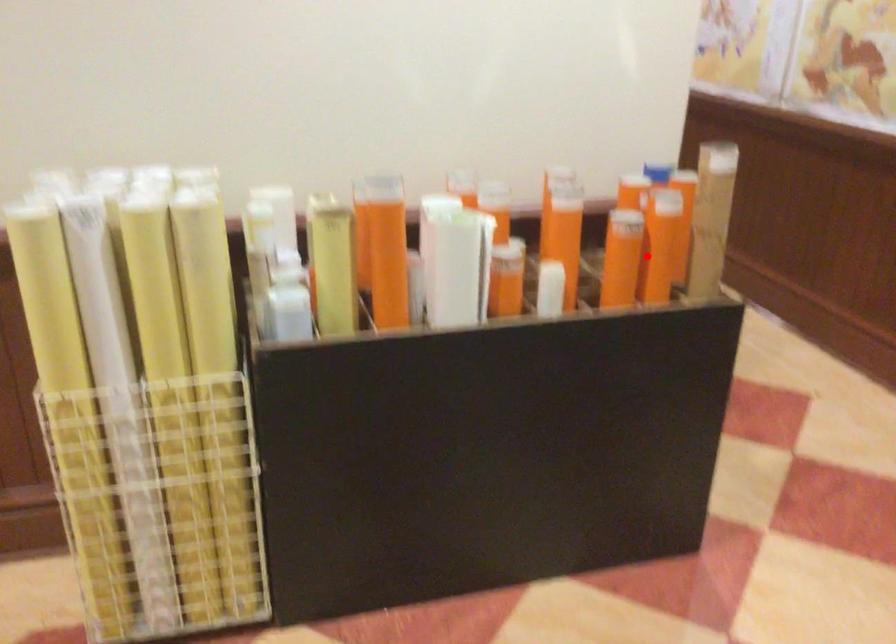
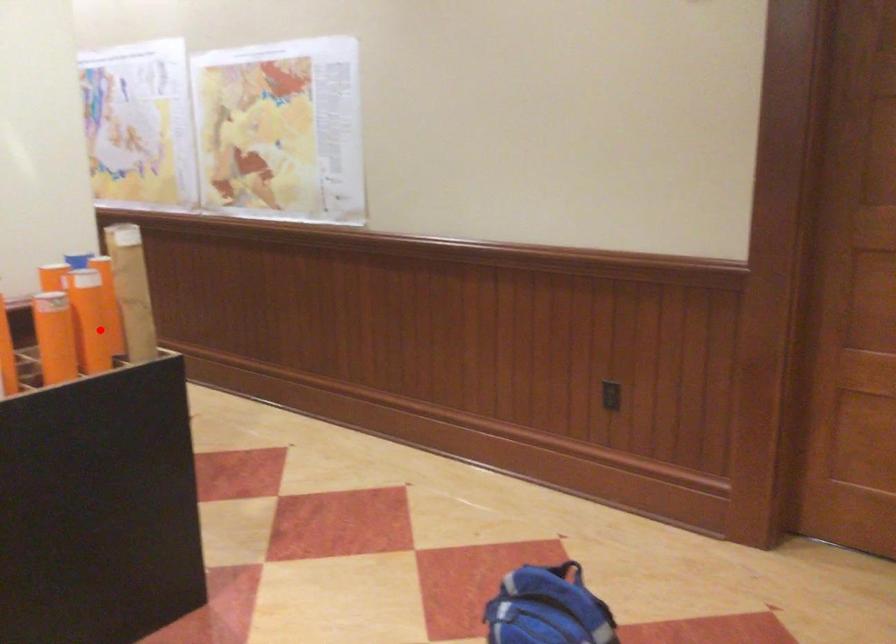
I am providing you with two images of the same scene from different viewpoints. A red point is marked on the first image and another point is marked on the second image. Is the red point in image1 aligned with the point shown in image2?

Yes